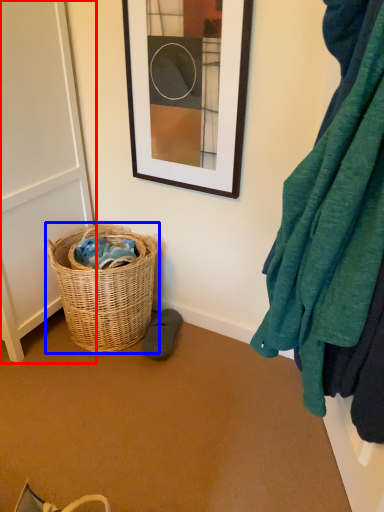
Question: Which object is closer to the camera taking this photo, screen door (highlighted by a red box) or picnic basket (highlighted by a blue box)?

Choices:
 (A) screen door
 (B) picnic basket

Answer: (A)